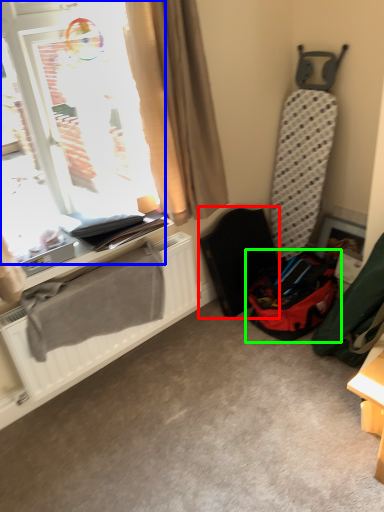
Question: Which object is positioned closest to folding chair (highlighted by a red box)? Select from window (highlighted by a blue box) and luggage and bags (highlighted by a green box).

Choices:
 (A) window
 (B) luggage and bags

Answer: (B)